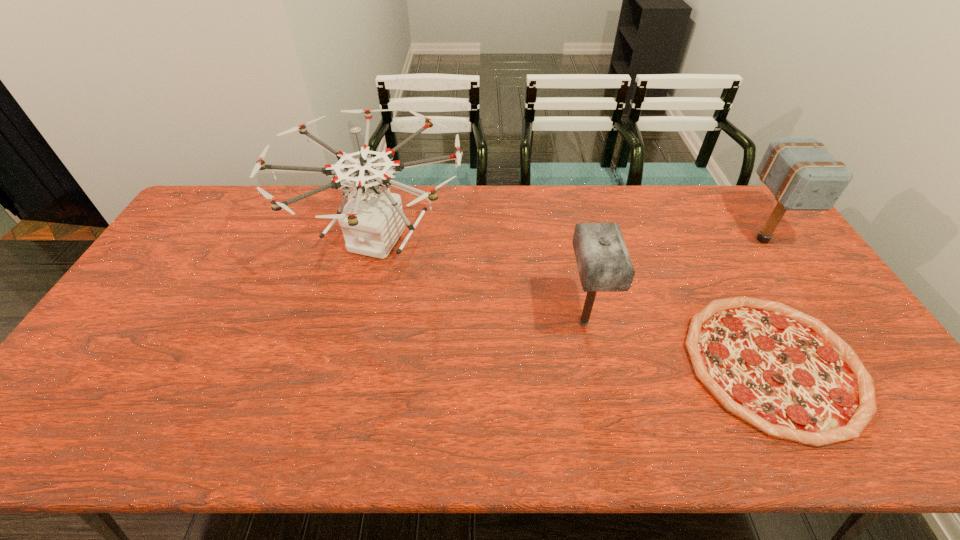
Locate an element on the screen. The height and width of the screenshot is (540, 960). mallet that is positioned at the far edge is located at coordinates (802, 174).

Where is `object that is positioned at the near edge`? The height and width of the screenshot is (540, 960). object that is positioned at the near edge is located at coordinates (786, 373).

Where is `mallet present at the right edge`? The height and width of the screenshot is (540, 960). mallet present at the right edge is located at coordinates (802, 174).

The width and height of the screenshot is (960, 540). Identify the location of pizza positioned at the right edge. (786, 373).

Locate an element on the screen. Image resolution: width=960 pixels, height=540 pixels. object at the far right corner is located at coordinates (802, 174).

Find the location of `object present at the near right corner`. object present at the near right corner is located at coordinates (786, 373).

Locate an element on the screen. vacant space at the far edge is located at coordinates (590, 222).

Where is `vacant space at the near edge of the desktop`? vacant space at the near edge of the desktop is located at coordinates (357, 428).

At what (x,y) coordinates should I click in order to perform the action: click on vacant space at the left edge of the desktop. Please return your answer as a coordinate pair (x, y). This screenshot has height=540, width=960. Looking at the image, I should click on (190, 244).

In the image, there is a desktop. At what (x,y) coordinates should I click in order to perform the action: click on vacant space at the far right corner. Please return your answer as a coordinate pair (x, y). This screenshot has height=540, width=960. Looking at the image, I should click on (741, 209).